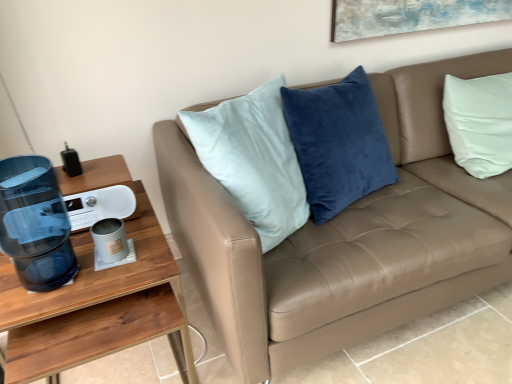
Question: Visually, is matte gray mug at lower left positioned to the left or to the right of wooden desk at left?

Choices:
 (A) right
 (B) left

Answer: (A)

Question: From a real-world perspective, is matte gray mug at lower left positioned above or below wooden desk at left?

Choices:
 (A) above
 (B) below

Answer: (A)

Question: Which of these objects is positioned farthest from the matte gray mug at lower left?

Choices:
 (A) transparent plastic water cooler at left
 (B) tan leather couch at center
 (C) wooden desk at left

Answer: (B)

Question: Estimate the real-world distances between objects in this image. Which object is closer to the transparent plastic water cooler at left?

Choices:
 (A) matte gray mug at lower left
 (B) wooden desk at left
 (C) tan leather couch at center

Answer: (B)